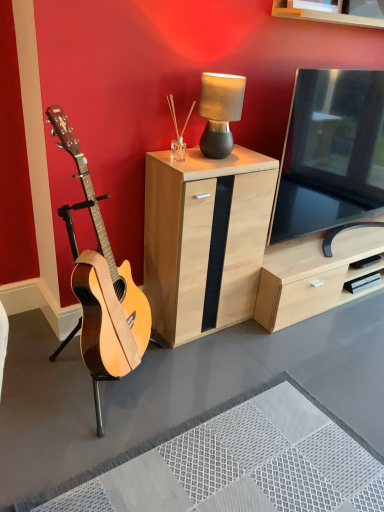
Question: Does matte black lamp at upper center have a lesser height compared to light wood/black panel cabinet at center?

Choices:
 (A) yes
 (B) no

Answer: (A)

Question: Is matte black lamp at upper center with light wood/black panel cabinet at center?

Choices:
 (A) no
 (B) yes

Answer: (A)

Question: Is matte black lamp at upper center completely or partially outside of light wood/black panel cabinet at center?

Choices:
 (A) yes
 (B) no

Answer: (A)

Question: Considering the relative positions of matte black lamp at upper center and light wood/black panel cabinet at center in the image provided, is matte black lamp at upper center in front of light wood/black panel cabinet at center?

Choices:
 (A) no
 (B) yes

Answer: (A)

Question: From a real-world perspective, is matte black lamp at upper center beneath light wood/black panel cabinet at center?

Choices:
 (A) no
 (B) yes

Answer: (A)

Question: Considering the positions of light wood/black panel cabinet at center and matte black lamp at upper center in the image, is light wood/black panel cabinet at center wider or thinner than matte black lamp at upper center?

Choices:
 (A) wide
 (B) thin

Answer: (A)

Question: From their relative heights in the image, would you say light wood/black panel cabinet at center is taller or shorter than matte black lamp at upper center?

Choices:
 (A) short
 (B) tall

Answer: (B)

Question: From a real-world perspective, is light wood/black panel cabinet at center positioned above or below matte black lamp at upper center?

Choices:
 (A) above
 (B) below

Answer: (B)

Question: In the image, is light wood/black panel cabinet at center positioned in front of or behind matte black lamp at upper center?

Choices:
 (A) front
 (B) behind

Answer: (A)

Question: Choose the correct answer: Is light wood/black panel cabinet at center inside black glossy tv at right or outside it?

Choices:
 (A) outside
 (B) inside

Answer: (A)

Question: Would you say light wood/black panel cabinet at center is to the left or to the right of black glossy tv at right in the picture?

Choices:
 (A) right
 (B) left

Answer: (B)

Question: From the image's perspective, is light wood/black panel cabinet at center above or below black glossy tv at right?

Choices:
 (A) below
 (B) above

Answer: (A)

Question: From their relative heights in the image, would you say light wood/black panel cabinet at center is taller or shorter than black glossy tv at right?

Choices:
 (A) short
 (B) tall

Answer: (A)

Question: From a real-world perspective, is black glossy tv at right above or below natural wood guitar at left?

Choices:
 (A) above
 (B) below

Answer: (A)

Question: Considering the positions of black glossy tv at right and natural wood guitar at left in the image, is black glossy tv at right bigger or smaller than natural wood guitar at left?

Choices:
 (A) small
 (B) big

Answer: (B)